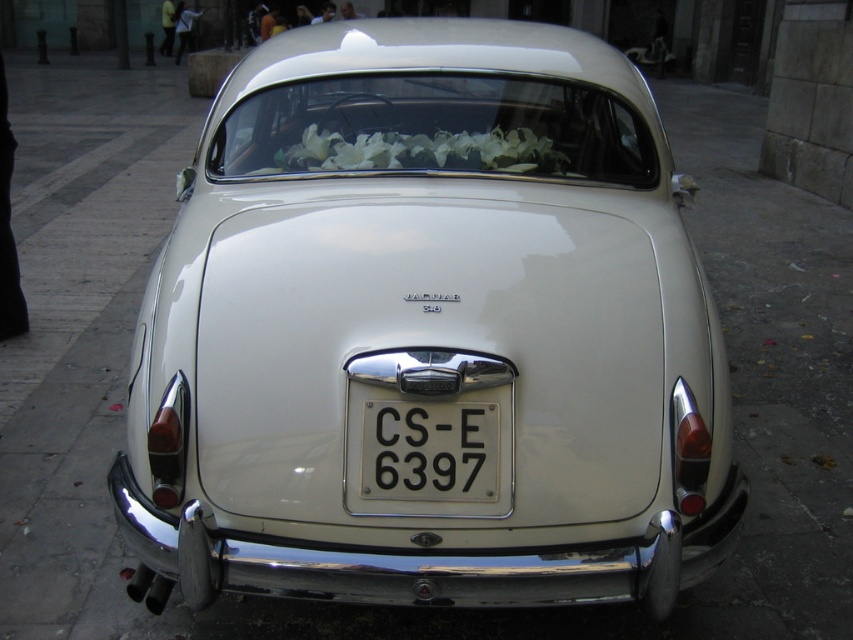
You are a photographer trying to capture the entire scene of the satin white car at center and the white floral garland at center in one shot. Based on their sizes, which object should you focus on to ensure both fit in the frame?

The satin white car at center is bigger than the white floral garland at center, so you should focus on the larger object, the satin white car at center, to ensure both fit in the frame.

Consider the image. You are standing behind the vintage Jaguar car and want to place two markers on the ground. The first marker should be placed at the location corresponding to point (492, 451), and the second at point (548, 166). From your perspective, which marker will be closer to the rear bumper of the car?

Point (492, 451) is in front of point (548, 166), so the marker at point (492, 451) will be closer to the rear bumper of the vintage Jaguar car.

You are a delivery person trying to place a package on the rear of the vintage Jaguar car. The package requires a flat surface that is at least 1.2 meters wide. Given the distance between the black metal license plate at center and the white floral garland at center, can you determine if the rear of the vintage Jaguar car has enough space for the package?

The black metal license plate at center and white floral garland at center are 1.19 meters apart from each other. Since the required space is 1.2 meters, the rear of the vintage Jaguar car does not have enough space for the package.